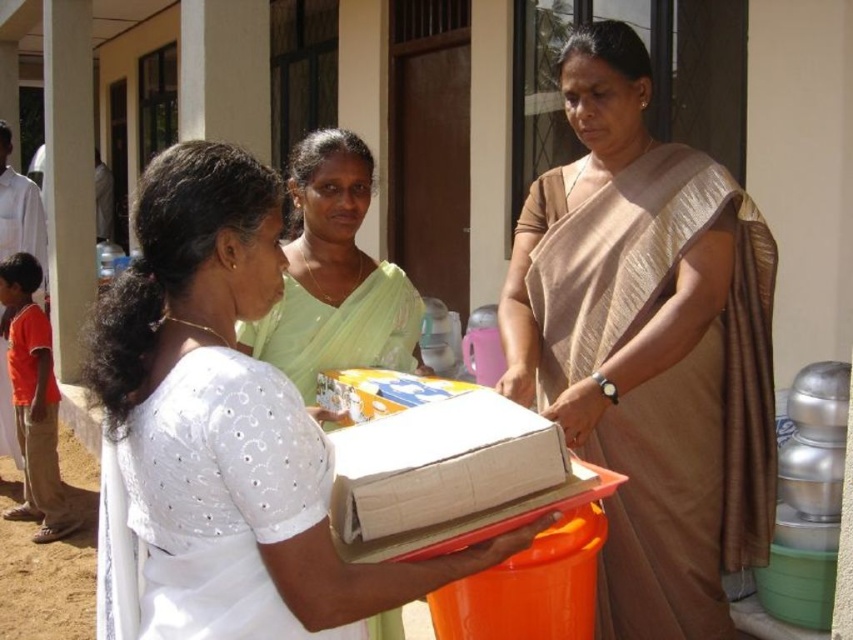
Does white lace blouse at center have a smaller size compared to light green silk saree at center?

Incorrect, white lace blouse at center is not smaller in size than light green silk saree at center.

Between white lace blouse at center and light green silk saree at center, which one appears on the left side from the viewer's perspective?

light green silk saree at center

At what (x,y) coordinates should I click in order to perform the action: click on white lace blouse at center. Please return your answer as a coordinate pair (x, y). Looking at the image, I should click on (228, 426).

Which is below, matte gold sari at center or light green silk saree at center?

matte gold sari at center

Who is taller, matte gold sari at center or light green silk saree at center?

matte gold sari at center

Where is `matte gold sari at center`? The height and width of the screenshot is (640, 853). matte gold sari at center is located at coordinates (648, 344).

Locate an element on the screen. This screenshot has height=640, width=853. matte gold sari at center is located at coordinates (648, 344).

Who is higher up, matte gold sari at center or white lace blouse at center?

matte gold sari at center

Is point (701, 636) behind point (125, 392)?

Yes, it is behind point (125, 392).

The width and height of the screenshot is (853, 640). In order to click on matte gold sari at center in this screenshot , I will do `click(648, 344)`.